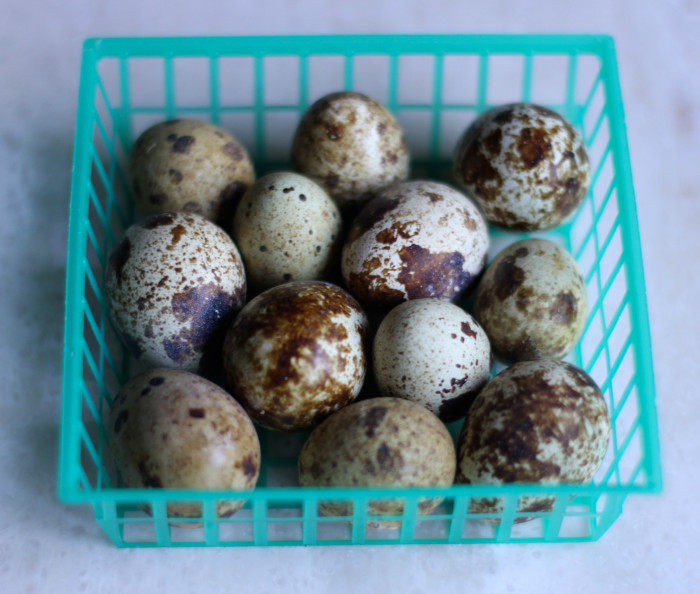
Where is `top right corner of basket`? This screenshot has height=594, width=700. top right corner of basket is located at coordinates (605, 49).